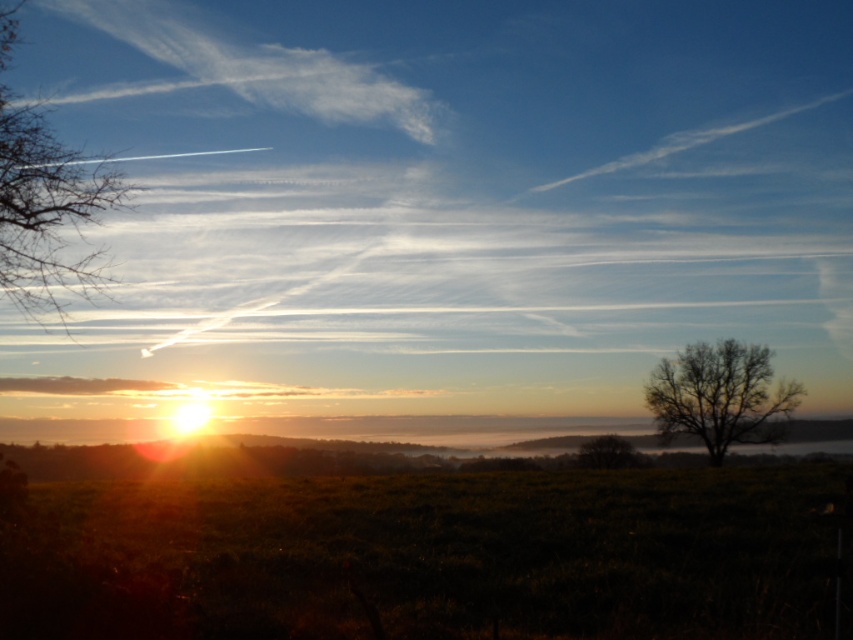
Question: Can you confirm if bare branches at left is positioned to the right of bare branches at right?

Choices:
 (A) no
 (B) yes

Answer: (A)

Question: Among these points, which one is nearest to the camera?

Choices:
 (A) (590, 461)
 (B) (770, 435)
 (C) (35, 307)
 (D) (415, 516)

Answer: (D)

Question: Is green grass at center below bare branches at right?

Choices:
 (A) no
 (B) yes

Answer: (A)

Question: Which point is closer to the camera?

Choices:
 (A) green grass at center
 (B) bare branches at left

Answer: (A)

Question: Which point is farther to the camera?

Choices:
 (A) (65, 173)
 (B) (662, 362)

Answer: (B)

Question: Is green grass at center wider than green matte tree at center?

Choices:
 (A) no
 (B) yes

Answer: (B)